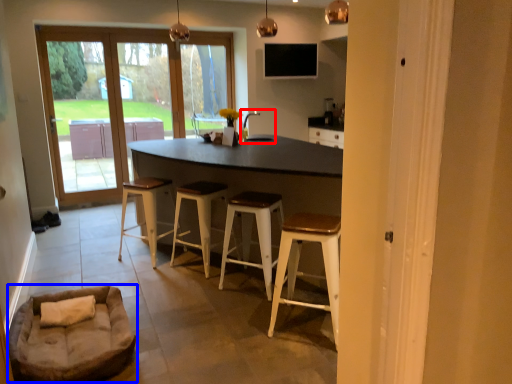
Question: Which of the following is the closest to the observer, sink (highlighted by a red box) or couch (highlighted by a blue box)?

Choices:
 (A) sink
 (B) couch

Answer: (B)